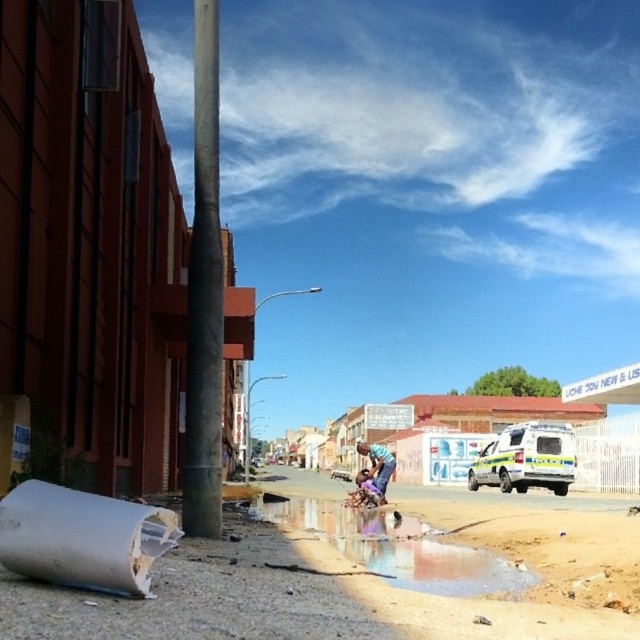
You are standing on the sidewalk looking down the street. There is a point marked at coordinates (x=525, y=458). What object is located at that point?

The point at (x=525, y=458) indicates a yellow green plastic ambulance at center right.

You are standing on the sidewalk and want to avoid stepping on the reflective wet surface at lower center. Based on your current position, which direction should you move to stay clear of it?

The reflective wet surface at lower center is located at point 0.855 on the x axis and 0.617 on the y axis. To avoid it, you should move away from those coordinates, either to the left or right depending on your current position.